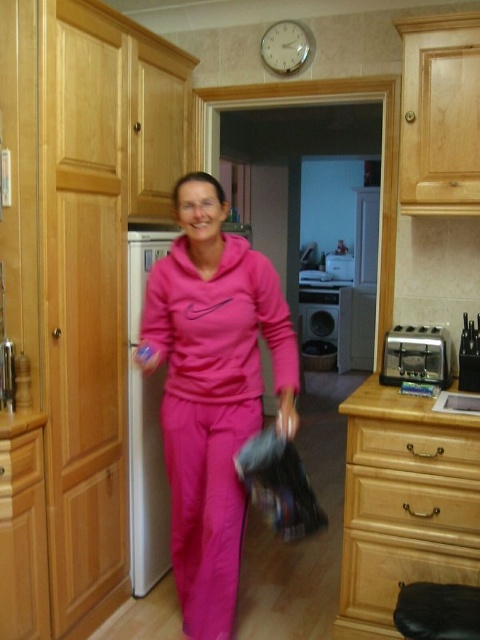
Question: Among these objects, which one is nearest to the camera?

Choices:
 (A) light wood drawer at lower right
 (B) wooden drawer at lower left
 (C) satin silver toaster at lower right

Answer: (B)

Question: Can you confirm if pink fleece tracksuit at center is positioned to the right of wooden drawer at lower left?

Choices:
 (A) no
 (B) yes

Answer: (B)

Question: Which object is positioned farthest from the light wood drawer at lower right?

Choices:
 (A) wooden drawer at lower left
 (B) satin silver toaster at lower right

Answer: (A)

Question: Which of these objects is positioned farthest from the satin silver toaster at lower right?

Choices:
 (A) wooden drawer at lower left
 (B) light wood drawer at lower right
 (C) pink fleece tracksuit at center
 (D) black plastic dishwasher at center

Answer: (D)

Question: Is satin silver toaster at lower right positioned before black plastic dishwasher at center?

Choices:
 (A) yes
 (B) no

Answer: (A)

Question: Is pink fleece tracksuit at center to the left of satin silver toaster at lower right from the viewer's perspective?

Choices:
 (A) no
 (B) yes

Answer: (B)